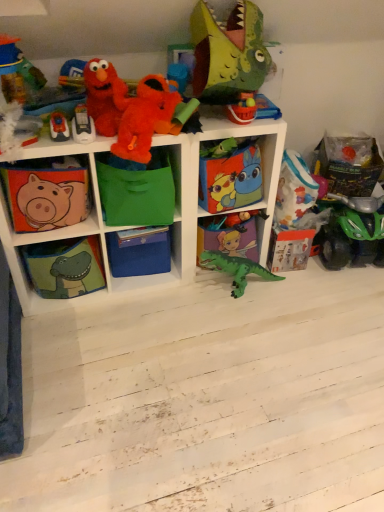
The image size is (384, 512). What are the coordinates of `vacant space underneath green plastic dinosaur at center, placed as the seventh toy when sorted from top to bottom (from a real-world perspective)` in the screenshot? It's located at (231, 284).